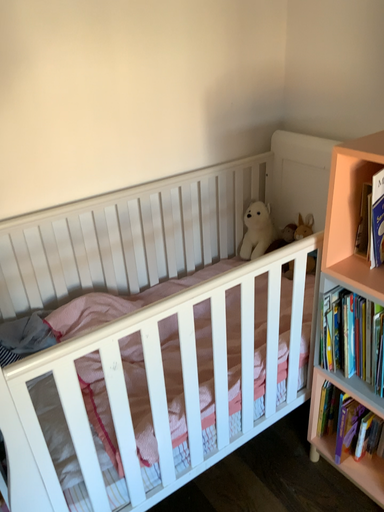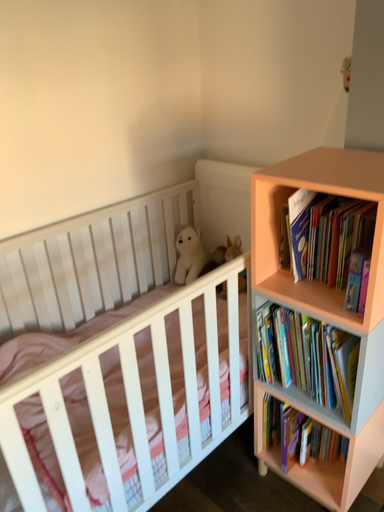
Question: How did the camera likely rotate when shooting the video?

Choices:
 (A) rotated right
 (B) rotated left

Answer: (A)